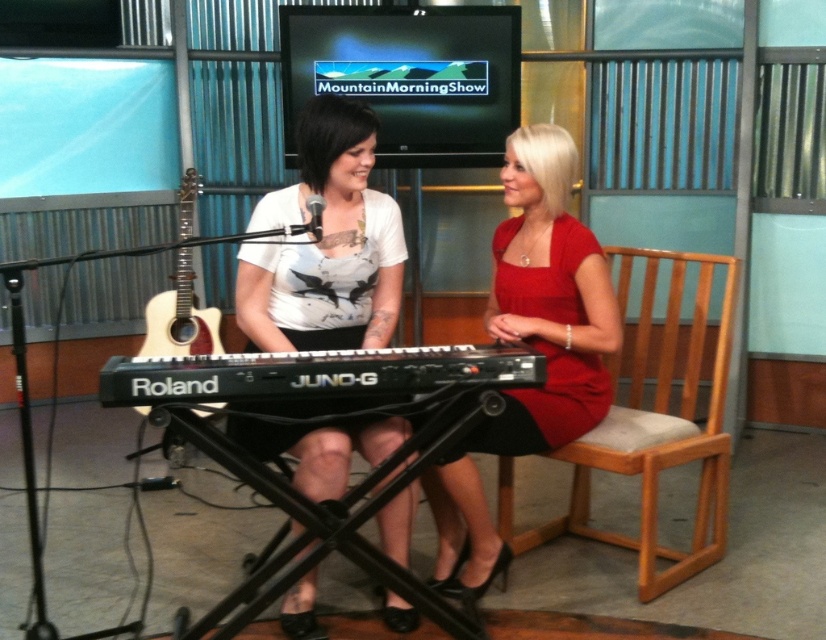
Question: Estimate the real-world distances between objects in this image. Which object is closer to the light brown wood chair at right?

Choices:
 (A) matte red dress at center
 (B) red satin dress at right
 (C) black plastic roland juno-g keyboard at center
 (D) acoustic wood guitar at left

Answer: (B)

Question: Considering the real-world distances, which object is closest to the white matte shirt at center?

Choices:
 (A) matte red dress at center
 (B) acoustic wood guitar at left
 (C) red satin dress at right

Answer: (A)

Question: Among these points, which one is farthest from the camera?

Choices:
 (A) [511, 476]
 (B) [205, 332]
 (C) [210, 365]

Answer: (B)

Question: Observing the image, what is the correct spatial positioning of matte red dress at center in reference to light brown wood chair at right?

Choices:
 (A) left
 (B) right

Answer: (A)

Question: Can you confirm if white matte shirt at center is wider than red satin dress at right?

Choices:
 (A) no
 (B) yes

Answer: (B)

Question: Can you confirm if matte red dress at center is smaller than black plastic roland juno-g keyboard at center?

Choices:
 (A) yes
 (B) no

Answer: (B)